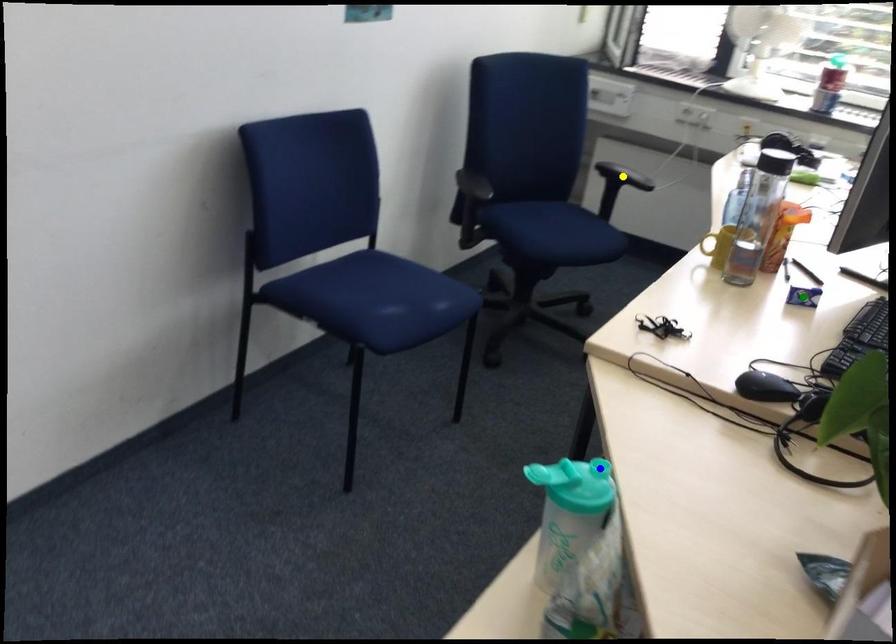
Order these from nearest to farthest:
A) yellow point
B) blue point
C) green point

yellow point < green point < blue point